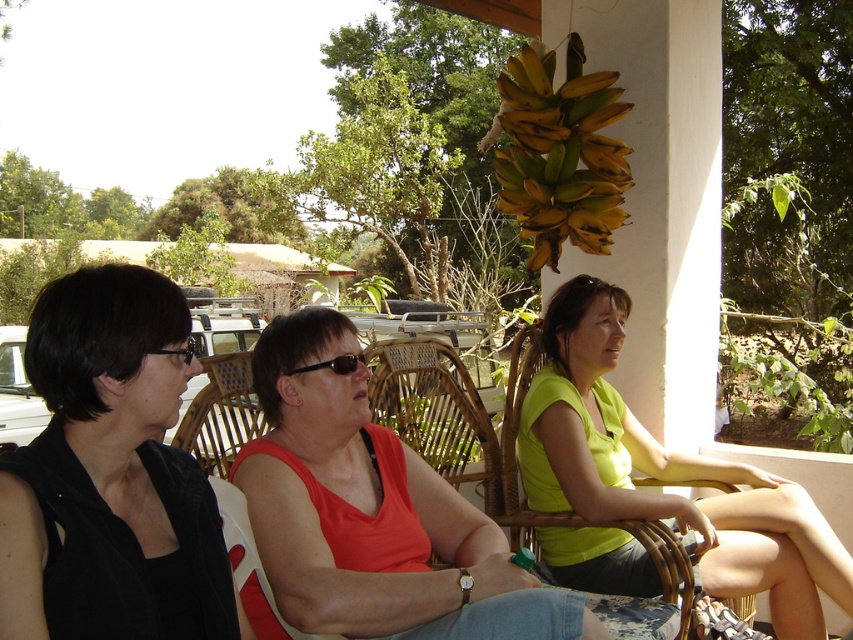
You are a photographer setting up a shot of the scene. You want to ensure that the matte orange tank top at center and the woven rattan chair at center are both clearly visible. Given their sizes, which object should you focus on first to ensure proper exposure?

The matte orange tank top at center has a larger size compared to the woven rattan chair at center, so you should focus on the matte orange tank top at center first to ensure proper exposure since it occupies more space in the frame.

You are a photographer trying to capture a closeup of the matte orange tank top at center and the woven rattan chair at center. Which object should you zoom in on first to ensure it appears larger in your photo?

The matte orange tank top at center is closer to the viewer than the woven rattan chair at center, so you should zoom in on the matte orange tank top at center first to make it appear larger in the photo.